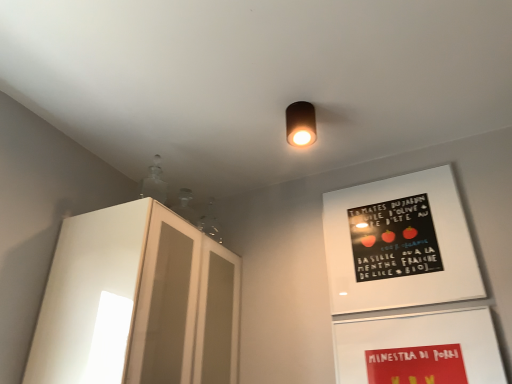
Where is `matte black cylinder at center`? matte black cylinder at center is located at coordinates (300, 124).

Identify the location of matte black poster at upper right, which is the 2th bulletin board in bottom-to-top order. (399, 244).

Considering the relative sizes of white glossy cabinet at left and matte white bulletin board at lower right, which appears as the 1th bulletin board when ordered from the bottom, in the image provided, is white glossy cabinet at left wider than matte white bulletin board at lower right, which appears as the 1th bulletin board when ordered from the bottom,?

Indeed, white glossy cabinet at left has a greater width compared to matte white bulletin board at lower right, which appears as the 1th bulletin board when ordered from the bottom.

Is white glossy cabinet at left bigger or smaller than matte white bulletin board at lower right, which appears as the 1th bulletin board when ordered from the bottom?

Considering their sizes, white glossy cabinet at left takes up more space than matte white bulletin board at lower right, which appears as the 1th bulletin board when ordered from the bottom.

Between white glossy cabinet at left and matte white bulletin board at lower right, which appears as the 1th bulletin board when ordered from the bottom, which one has more height?

With more height is white glossy cabinet at left.

Is white glossy cabinet at left positioned far away from matte white bulletin board at lower right, which appears as the 1th bulletin board when ordered from the bottom?

That's not correct — white glossy cabinet at left is a little close to matte white bulletin board at lower right, which appears as the 1th bulletin board when ordered from the bottom.

Is white glossy cabinet at left completely or partially inside matte white bulletin board at lower right, the second bulletin board viewed from the top?

That's incorrect, white glossy cabinet at left is not inside matte white bulletin board at lower right, the second bulletin board viewed from the top.

Is matte white bulletin board at lower right, which appears as the 1th bulletin board when ordered from the bottom, further to camera compared to white glossy cabinet at left?

Yes, it is behind white glossy cabinet at left.

From the image's perspective, which one is positioned lower, matte white bulletin board at lower right, which appears as the 1th bulletin board when ordered from the bottom, or white glossy cabinet at left?

matte white bulletin board at lower right, which appears as the 1th bulletin board when ordered from the bottom, from the image's perspective.

Considering the relative sizes of matte white bulletin board at lower right, the second bulletin board viewed from the top, and white glossy cabinet at left in the image provided, is matte white bulletin board at lower right, the second bulletin board viewed from the top, bigger than white glossy cabinet at left?

Incorrect, matte white bulletin board at lower right, the second bulletin board viewed from the top, is not larger than white glossy cabinet at left.

From the image's perspective, is matte black cylinder at center located above or below matte white bulletin board at lower right, the second bulletin board viewed from the top?

matte black cylinder at center is above matte white bulletin board at lower right, the second bulletin board viewed from the top.

Based on the photo, from a real-world perspective, is matte black cylinder at center over matte white bulletin board at lower right, which appears as the 1th bulletin board when ordered from the bottom?

Yes, from a real-world perspective, matte black cylinder at center is over matte white bulletin board at lower right, which appears as the 1th bulletin board when ordered from the bottom

Locate an element on the screen. The image size is (512, 384). lamp located on the left of matte white bulletin board at lower right, the second bulletin board viewed from the top is located at coordinates (300, 124).

Which object is closer to the camera taking this photo, matte black cylinder at center or matte black poster at upper right, which ranks as the first bulletin board in top-to-bottom order?

Positioned in front is matte black poster at upper right, which ranks as the first bulletin board in top-to-bottom order.

Between matte black cylinder at center and matte black poster at upper right, which is the 2th bulletin board in bottom-to-top order, which one has smaller width?

matte black poster at upper right, which is the 2th bulletin board in bottom-to-top order, is thinner.

Consider the image. From a real-world perspective, relative to matte black poster at upper right, which ranks as the first bulletin board in top-to-bottom order, is matte black cylinder at center vertically above or below?

matte black cylinder at center is situated higher than matte black poster at upper right, which ranks as the first bulletin board in top-to-bottom order, in the real world.

Where is `bulletin board that is the 1st object located below the matte black cylinder at center (from the image's perspective)`? The width and height of the screenshot is (512, 384). bulletin board that is the 1st object located below the matte black cylinder at center (from the image's perspective) is located at coordinates (399, 244).

Consider the image. Looking at their sizes, would you say matte black poster at upper right, which is the 2th bulletin board in bottom-to-top order, is wider or thinner than matte white bulletin board at lower right, which appears as the 1th bulletin board when ordered from the bottom?

matte black poster at upper right, which is the 2th bulletin board in bottom-to-top order, is wider than matte white bulletin board at lower right, which appears as the 1th bulletin board when ordered from the bottom.

From a real-world perspective, is matte black poster at upper right, which ranks as the first bulletin board in top-to-bottom order, positioned under matte white bulletin board at lower right, which appears as the 1th bulletin board when ordered from the bottom, based on gravity?

No.

Are matte black poster at upper right, which ranks as the first bulletin board in top-to-bottom order, and matte white bulletin board at lower right, the second bulletin board viewed from the top, far apart?

They are positioned close to each other.

Is the position of matte black poster at upper right, which is the 2th bulletin board in bottom-to-top order, less distant than that of matte white bulletin board at lower right, which appears as the 1th bulletin board when ordered from the bottom?

That is False.

Is white glossy cabinet at left to the right of matte black poster at upper right, which is the 2th bulletin board in bottom-to-top order, from the viewer's perspective?

In fact, white glossy cabinet at left is to the left of matte black poster at upper right, which is the 2th bulletin board in bottom-to-top order.

Is matte black poster at upper right, which ranks as the first bulletin board in top-to-bottom order, surrounded by white glossy cabinet at left?

No, matte black poster at upper right, which ranks as the first bulletin board in top-to-bottom order, is located outside of white glossy cabinet at left.

Considering the sizes of white glossy cabinet at left and matte black poster at upper right, which ranks as the first bulletin board in top-to-bottom order, in the image, is white glossy cabinet at left taller or shorter than matte black poster at upper right, which ranks as the first bulletin board in top-to-bottom order,?

Considering their sizes, white glossy cabinet at left has more height than matte black poster at upper right, which ranks as the first bulletin board in top-to-bottom order.

Can you confirm if white glossy cabinet at left is thinner than matte black cylinder at center?

No.

Considering the relative positions of white glossy cabinet at left and matte black cylinder at center in the image provided, is white glossy cabinet at left to the left of matte black cylinder at center from the viewer's perspective?

Yes.

Is white glossy cabinet at left bigger than matte black cylinder at center?

Yes.

Find the location of a particular element. bulletin board that is under the white glossy cabinet at left (from a real-world perspective) is located at coordinates (419, 348).

The height and width of the screenshot is (384, 512). I want to click on cabinetry in front of the matte white bulletin board at lower right, which appears as the 1th bulletin board when ordered from the bottom, so click(135, 302).

Considering their positions, is matte black poster at upper right, which ranks as the first bulletin board in top-to-bottom order, positioned closer to matte black cylinder at center than matte white bulletin board at lower right, which appears as the 1th bulletin board when ordered from the bottom?

matte black poster at upper right, which ranks as the first bulletin board in top-to-bottom order, is closer to matte black cylinder at center.

When comparing their distances from matte black poster at upper right, which ranks as the first bulletin board in top-to-bottom order, does matte black cylinder at center or matte white bulletin board at lower right, which appears as the 1th bulletin board when ordered from the bottom, seem closer?

Based on the image, matte white bulletin board at lower right, which appears as the 1th bulletin board when ordered from the bottom, appears to be nearer to matte black poster at upper right, which ranks as the first bulletin board in top-to-bottom order.

Based on the photo, which object lies nearer to the anchor point matte black cylinder at center, matte black poster at upper right, which is the 2th bulletin board in bottom-to-top order, or white glossy cabinet at left?

The object closer to matte black cylinder at center is matte black poster at upper right, which is the 2th bulletin board in bottom-to-top order.

Which object lies further to the anchor point white glossy cabinet at left, matte black poster at upper right, which is the 2th bulletin board in bottom-to-top order, or matte white bulletin board at lower right, the second bulletin board viewed from the top?

Among the two, matte white bulletin board at lower right, the second bulletin board viewed from the top, is located further to white glossy cabinet at left.

From the image, which object appears to be nearer to matte white bulletin board at lower right, the second bulletin board viewed from the top, matte black cylinder at center or white glossy cabinet at left?

Based on the image, white glossy cabinet at left appears to be nearer to matte white bulletin board at lower right, the second bulletin board viewed from the top.

When comparing their distances from white glossy cabinet at left, does matte black cylinder at center or matte black poster at upper right, which is the 2th bulletin board in bottom-to-top order, seem closer?

The object closer to white glossy cabinet at left is matte black poster at upper right, which is the 2th bulletin board in bottom-to-top order.

Which object lies nearer to the anchor point white glossy cabinet at left, matte white bulletin board at lower right, which appears as the 1th bulletin board when ordered from the bottom, or matte black cylinder at center?

matte white bulletin board at lower right, which appears as the 1th bulletin board when ordered from the bottom, is closer to white glossy cabinet at left.

Considering their positions, is matte black poster at upper right, which ranks as the first bulletin board in top-to-bottom order, positioned further to matte white bulletin board at lower right, the second bulletin board viewed from the top, than white glossy cabinet at left?

white glossy cabinet at left is further to matte white bulletin board at lower right, the second bulletin board viewed from the top.

I want to click on lamp located between white glossy cabinet at left and matte black poster at upper right, which is the 2th bulletin board in bottom-to-top order, in the left-right direction, so click(x=300, y=124).

The width and height of the screenshot is (512, 384). In order to click on lamp located between white glossy cabinet at left and matte white bulletin board at lower right, the second bulletin board viewed from the top, in the left-right direction in this screenshot , I will do `click(300, 124)`.

Where is `bulletin board between white glossy cabinet at left and matte black poster at upper right, which ranks as the first bulletin board in top-to-bottom order, from left to right`? bulletin board between white glossy cabinet at left and matte black poster at upper right, which ranks as the first bulletin board in top-to-bottom order, from left to right is located at coordinates (419, 348).

Where is `bulletin board between matte black cylinder at center and matte white bulletin board at lower right, which appears as the 1th bulletin board when ordered from the bottom, in the up-down direction`? bulletin board between matte black cylinder at center and matte white bulletin board at lower right, which appears as the 1th bulletin board when ordered from the bottom, in the up-down direction is located at coordinates (399, 244).